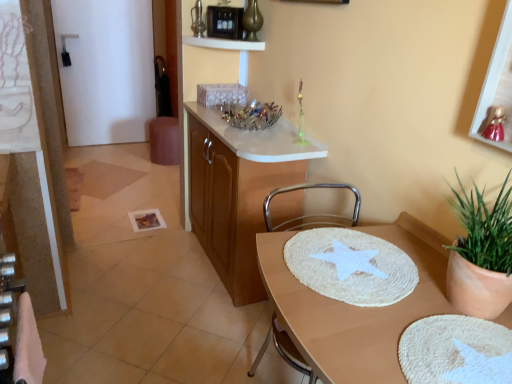
In order to click on free location above white woven mat at center (from a real-world perspective) in this screenshot , I will do click(354, 260).